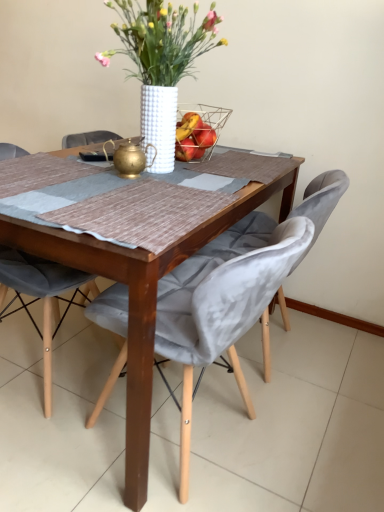
Question: From a real-world perspective, relative to wooden table at center, is velvet grey chair at center, acting as the second chair starting from the right, vertically above or below?

Choices:
 (A) above
 (B) below

Answer: (A)

Question: In terms of size, does velvet grey chair at center, which is the first chair in left-to-right order, appear bigger or smaller than wooden table at center?

Choices:
 (A) small
 (B) big

Answer: (A)

Question: Which of these objects is positioned farthest from the velvet grey chair at center, the 1th chair positioned from the right?

Choices:
 (A) white textured vase at center
 (B) gold metallic teapot at center
 (C) wire mesh basket at center
 (D) velvet grey chair at center, acting as the second chair starting from the right
 (E) wooden table at center

Answer: (C)

Question: Which of these objects is positioned farthest from the gold metallic teapot at center?

Choices:
 (A) velvet grey chair at center, acting as the 2th chair starting from the left
 (B) velvet grey chair at center, acting as the second chair starting from the right
 (C) white textured vase at center
 (D) wire mesh basket at center
 (E) wooden table at center

Answer: (B)